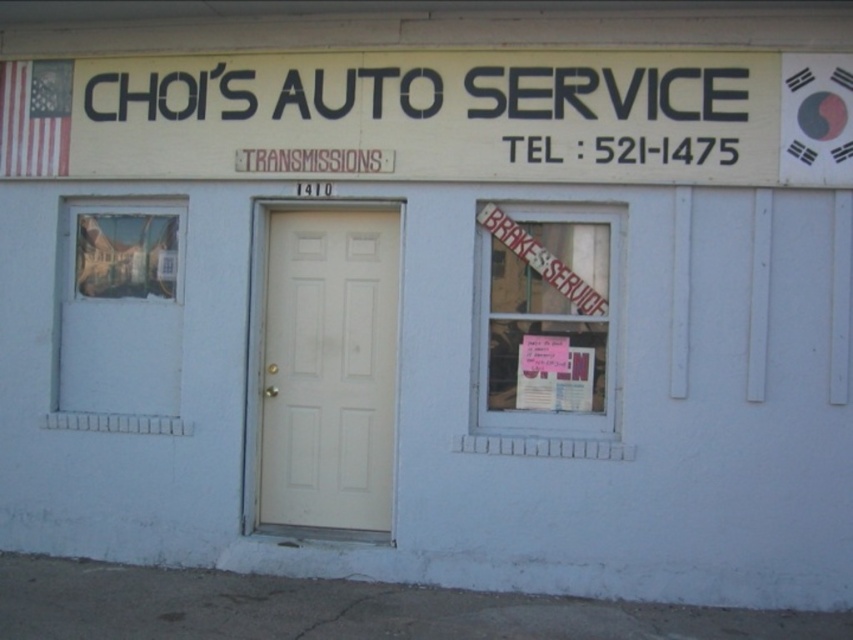
Question: Which of the following is the farthest from the observer?

Choices:
 (A) (561, 221)
 (B) (579, 120)
 (C) (173, 244)
 (D) (376, 444)

Answer: (C)

Question: Is matte white door at center thinner than clear glass window at center right?

Choices:
 (A) no
 (B) yes

Answer: (A)

Question: Which object is closer to the camera taking this photo?

Choices:
 (A) transparent glass window at left
 (B) clear glass window at center right
 (C) matte white door at center
 (D) black plastic sign at upper center

Answer: (D)

Question: Is black plastic sign at upper center bigger than matte white door at center?

Choices:
 (A) yes
 (B) no

Answer: (A)

Question: Does matte white door at center have a greater width compared to clear glass window at center right?

Choices:
 (A) no
 (B) yes

Answer: (B)

Question: Which of the following is the closest to the observer?

Choices:
 (A) click(x=248, y=156)
 (B) click(x=601, y=326)
 (C) click(x=270, y=516)
 (D) click(x=115, y=300)

Answer: (B)